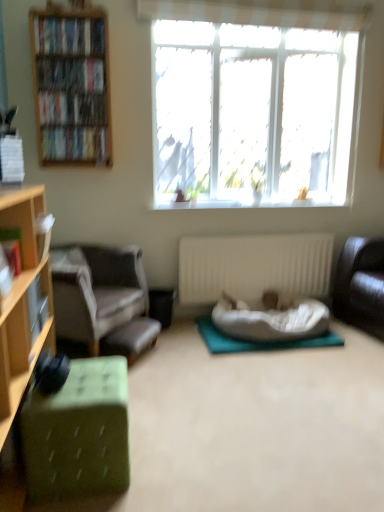
The image size is (384, 512). In order to click on free space above wooden bookshelf at left, which ranks as the second cabinetry in bottom-to-top order (from a real-world perspective) in this screenshot , I will do `click(76, 10)`.